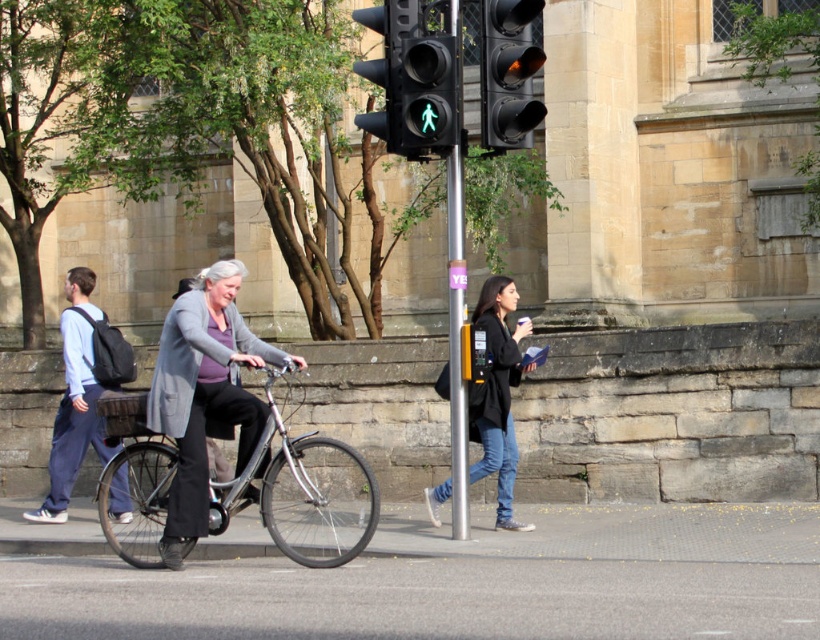
Can you confirm if silver metallic bicycle at center is positioned below black leather jacket at center?

Yes, silver metallic bicycle at center is below black leather jacket at center.

Describe the element at coordinates (304, 493) in the screenshot. I see `silver metallic bicycle at center` at that location.

This screenshot has width=820, height=640. What do you see at coordinates (304, 493) in the screenshot?
I see `silver metallic bicycle at center` at bounding box center [304, 493].

I want to click on silver metallic bicycle at center, so click(x=304, y=493).

Consider the image. Does silver metallic bicycle at center appear over matte blue shirt at left?

No, silver metallic bicycle at center is not above matte blue shirt at left.

Find the location of a particular element. This screenshot has width=820, height=640. silver metallic bicycle at center is located at coordinates (304, 493).

Who is shorter, silver metallic bicycle at center or silver metallic pole at center?

Standing shorter between the two is silver metallic bicycle at center.

Does silver metallic bicycle at center have a larger size compared to silver metallic pole at center?

Correct, silver metallic bicycle at center is larger in size than silver metallic pole at center.

Which is behind, point (265, 492) or point (467, 490)?

The point (467, 490) is behind.

Locate an element on the screen. Image resolution: width=820 pixels, height=640 pixels. silver metallic bicycle at center is located at coordinates (304, 493).